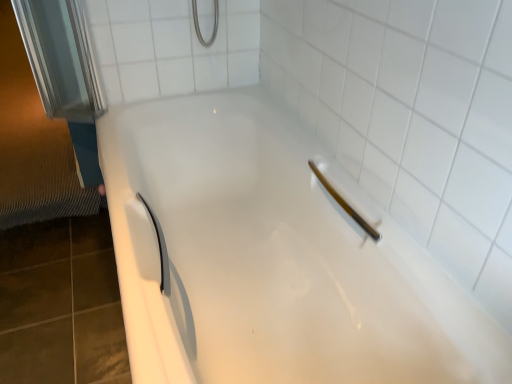
Question: Is matte white shower at upper right spatially inside white ceramic tile at upper center, or outside of it?

Choices:
 (A) inside
 (B) outside

Answer: (B)

Question: From a real-world perspective, is matte white shower at upper right positioned above or below white ceramic tile at upper center?

Choices:
 (A) above
 (B) below

Answer: (B)

Question: Which object is positioned closest to the white ceramic tile at upper center?

Choices:
 (A) matte white shower at upper right
 (B) white glossy bathtub at center

Answer: (B)

Question: Considering the real-world distances, which object is closest to the white glossy bathtub at center?

Choices:
 (A) matte white shower at upper right
 (B) white ceramic tile at upper center

Answer: (A)